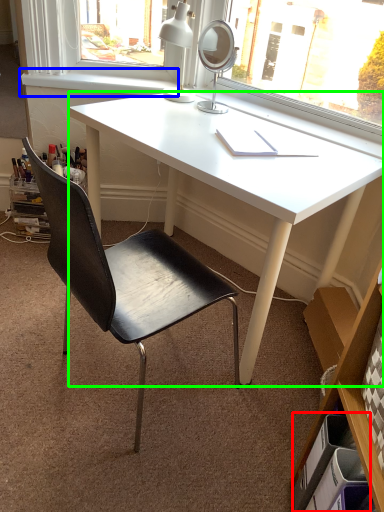
Question: Based on their relative distances, which object is nearer to drawer (highlighted by a red box)? Choose from window sill (highlighted by a blue box) and desk (highlighted by a green box).

Choices:
 (A) window sill
 (B) desk

Answer: (B)